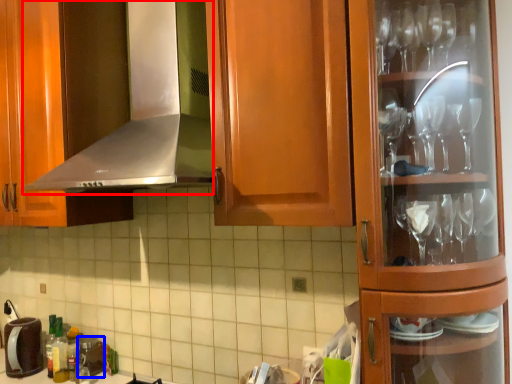
Question: Which point is closer to the camera, exhaust hood (highlighted by a red box) or appliance (highlighted by a blue box)?

Choices:
 (A) exhaust hood
 (B) appliance

Answer: (A)